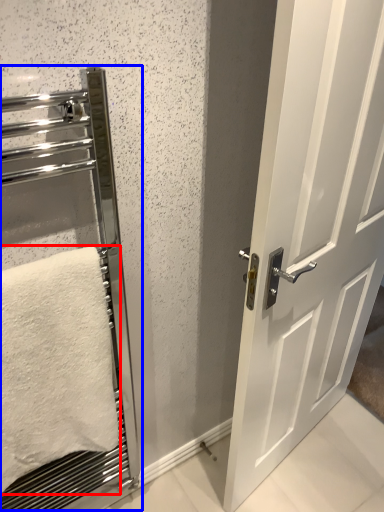
Question: Among these objects, which one is farthest to the camera, towel (highlighted by a red box) or elevator (highlighted by a blue box)?

Choices:
 (A) towel
 (B) elevator

Answer: (A)